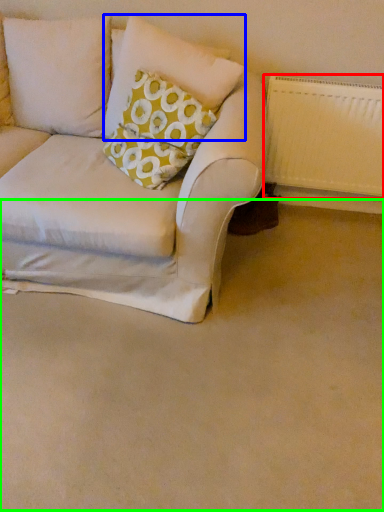
Question: Estimate the real-world distances between objects in this image. Which object is closer to radiator (highlighted by a red box), pillow (highlighted by a blue box) or plain (highlighted by a green box)?

Choices:
 (A) pillow
 (B) plain

Answer: (A)